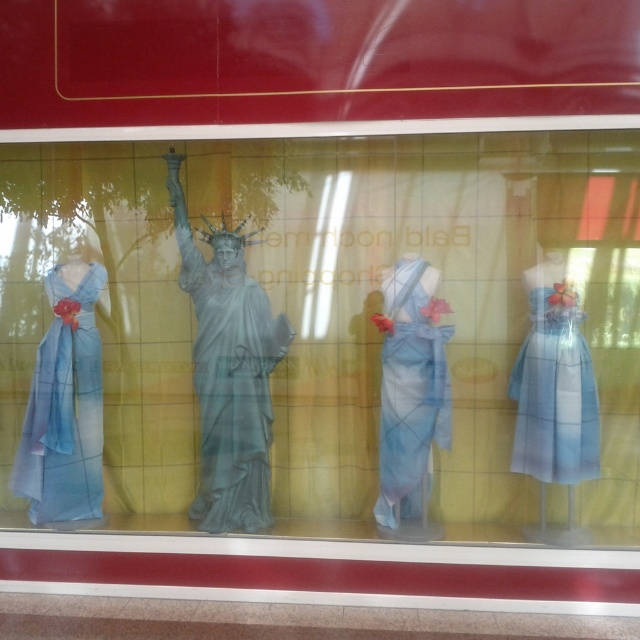
You are an interior designer who wants to place a new decorative item between the matte blue statue at center and the matte blue dress at left. Considering their sizes, which object should the new item be placed closer to?

The matte blue statue at center is bigger than the matte blue dress at left, so the new item should be placed closer to the matte blue dress at left to maintain balance.

You are a fashion designer observing the display window. You need to determine which dress is taller between the matte blue fabric dress at center and the light blue sheer dress at right. Which one is taller?

The matte blue fabric dress at center is taller than the light blue sheer dress at right according to the description.

You are a customer trying to decide between the matte blue dress at left and the light blue sheer dress at right. Based on the display window, which dress has a wider silhouette?

The matte blue dress at left has a wider silhouette than the light blue sheer dress at right.